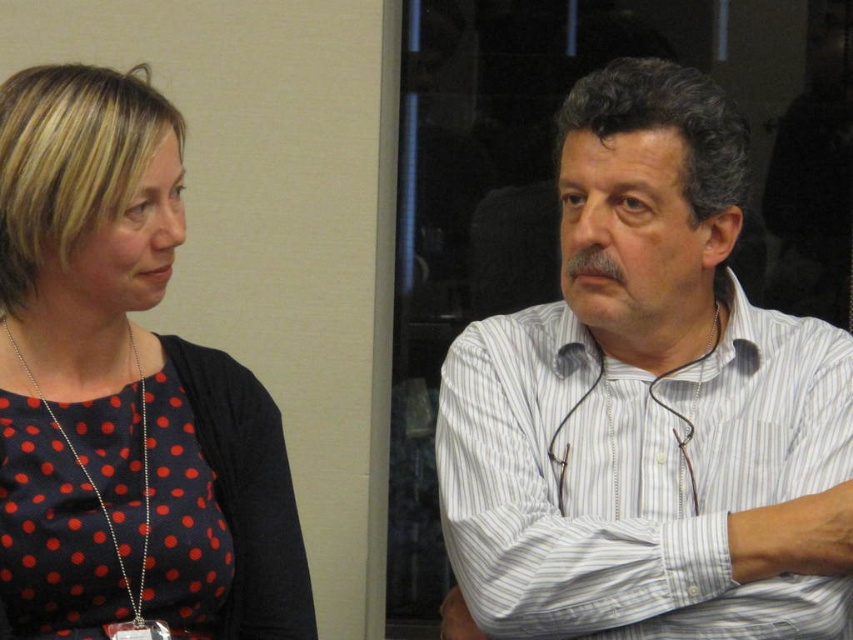
Who is more distant from viewer, (538,520) or (53,294)?

Positioned behind is point (53,294).

The width and height of the screenshot is (853, 640). In order to click on white striped shirt at right in this screenshot , I will do `click(648, 404)`.